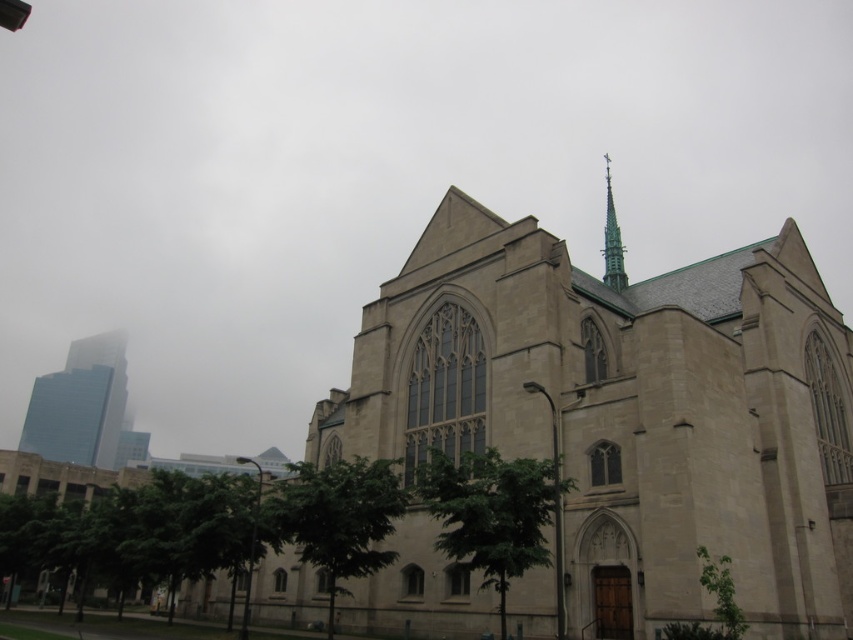
Based on the photo, who is positioned more to the right, glassy teal skyscraper at left or green leafy tree at lower right?

Positioned to the right is green leafy tree at lower right.

Who is higher up, glassy teal skyscraper at left or green leafy tree at lower right?

green leafy tree at lower right is above.

Does point (62, 378) come in front of point (720, 566)?

No, (62, 378) is behind (720, 566).

Where is `glassy teal skyscraper at left`? glassy teal skyscraper at left is located at coordinates (80, 404).

Is point (724, 627) closer to camera compared to point (605, 170)?

That is True.

Between point (732, 632) and point (621, 273), which one is positioned in front?

Point (732, 632)

Looking at this image, who is more distant from viewer, (670, 637) or (607, 192)?

The point (607, 192) is behind.

The image size is (853, 640). In order to click on green leafy tree at lower right in this screenshot , I will do `click(714, 604)`.

Locate an element on the screen. The width and height of the screenshot is (853, 640). green leafy tree at center is located at coordinates (491, 513).

Is green leafy tree at center shorter than green leafy tree at lower right?

No, green leafy tree at center is not shorter than green leafy tree at lower right.

In order to click on green leafy tree at center in this screenshot , I will do `click(491, 513)`.